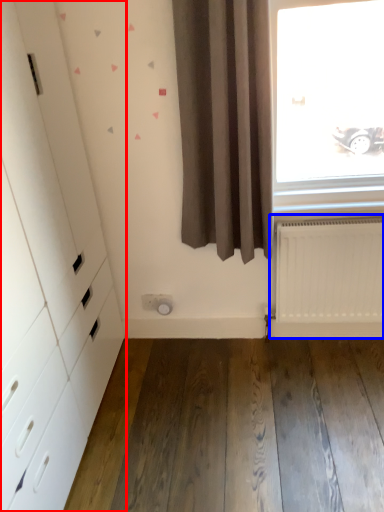
Question: Which object is further to the camera taking this photo, dresser (highlighted by a red box) or radiator (highlighted by a blue box)?

Choices:
 (A) dresser
 (B) radiator

Answer: (B)